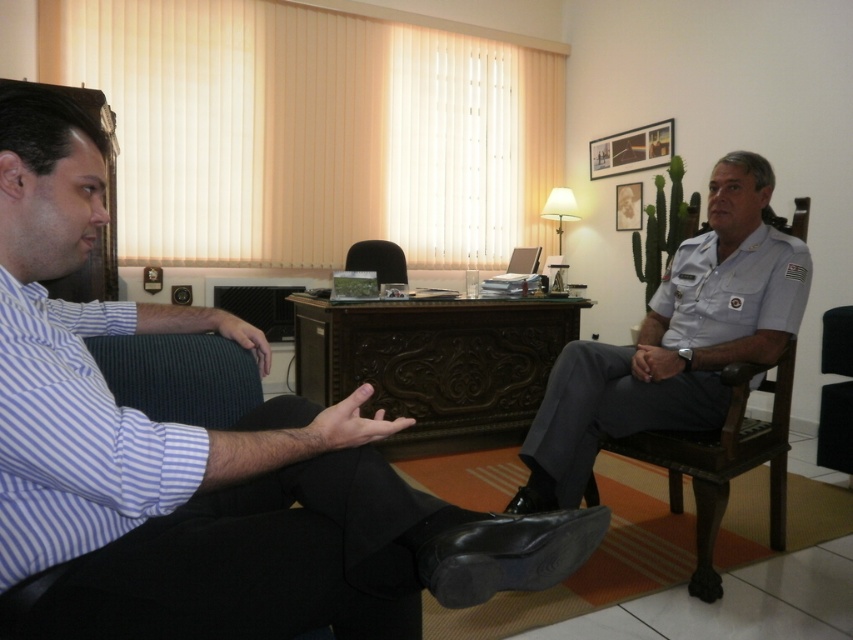
Question: Which is farther from the black leather armchair at center?

Choices:
 (A) light brown wooden armchair at right
 (B) matte black suit at left

Answer: (B)

Question: Does light brown wooden armchair at right have a smaller size compared to black leather armchair at center?

Choices:
 (A) no
 (B) yes

Answer: (A)

Question: Estimate the real-world distances between objects in this image. Which object is closer to the matte black suit at left?

Choices:
 (A) light brown wooden armchair at right
 (B) black leather armchair at center

Answer: (A)

Question: Which point appears closest to the camera in this image?

Choices:
 (A) (399, 264)
 (B) (706, 470)

Answer: (B)

Question: Does matte black suit at left have a lesser width compared to black leather armchair at center?

Choices:
 (A) yes
 (B) no

Answer: (B)

Question: Does matte black suit at left come in front of light brown wooden armchair at right?

Choices:
 (A) no
 (B) yes

Answer: (B)